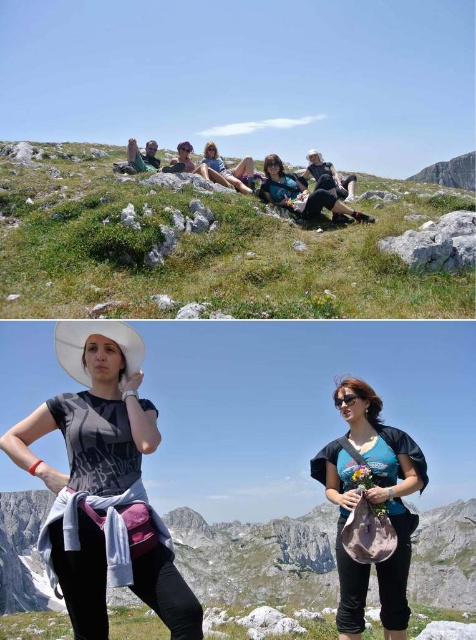
Question: Observing the image, what is the correct spatial positioning of green grassy at lower center in reference to matte black shirt at center?

Choices:
 (A) above
 (B) below

Answer: (B)

Question: Can you confirm if matte gray shirt at center is positioned below green grassy at lower center?

Choices:
 (A) yes
 (B) no

Answer: (B)

Question: Among these objects, which one is farthest from the camera?

Choices:
 (A) matte gray shirt at center
 (B) rugged stone mountain at center
 (C) teal jersey at center

Answer: (B)

Question: Which is nearer to the teal jersey at center?

Choices:
 (A) white matte cowboy hat at center
 (B) green grassy at lower center
 (C) green grassy hillside at center

Answer: (A)

Question: Considering the real-world distances, which object is farthest from the rugged stone mountain at center?

Choices:
 (A) matte gray shirt at center
 (B) green grassy hillside at center
 (C) teal jersey at center

Answer: (B)

Question: Can you confirm if green grassy hillside at center is smaller than matte black shirt at center?

Choices:
 (A) yes
 (B) no

Answer: (B)